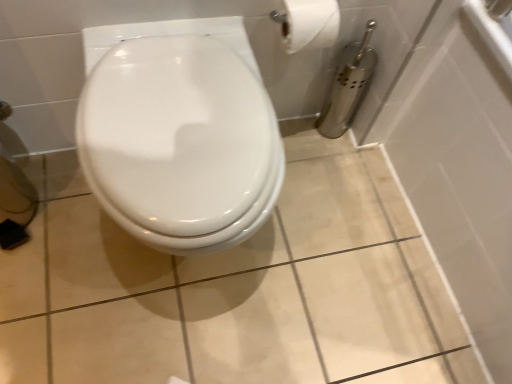
Image resolution: width=512 pixels, height=384 pixels. What do you see at coordinates (180, 143) in the screenshot?
I see `white glossy toilet at center` at bounding box center [180, 143].

This screenshot has height=384, width=512. I want to click on white glossy toilet at center, so click(x=180, y=143).

The width and height of the screenshot is (512, 384). Identify the location of white glossy toilet at center. (180, 143).